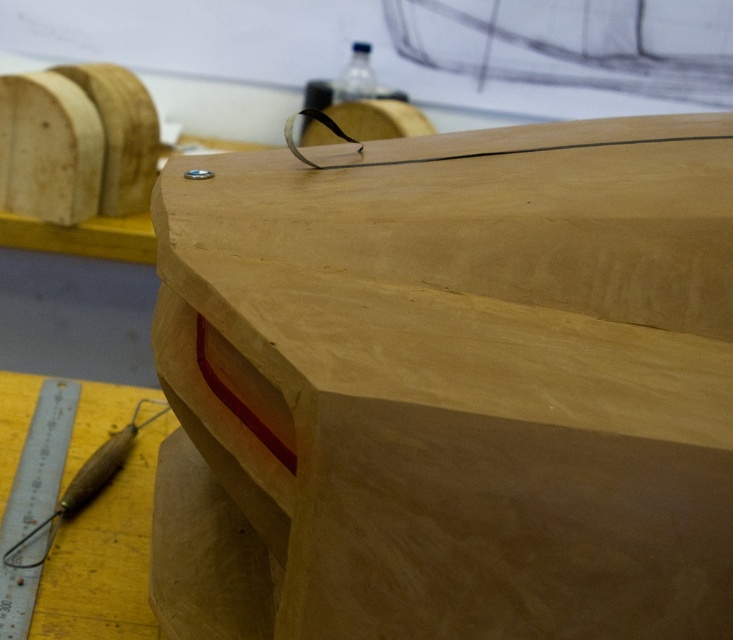
Measure the distance from natural wood plywood at center to wooden carving tool at lower left.

The distance of natural wood plywood at center from wooden carving tool at lower left is 27.07 inches.

Is point (485, 193) more distant than point (95, 467)?

No, (485, 193) is in front of (95, 467).

I want to click on natural wood plywood at center, so click(467, 374).

Image resolution: width=733 pixels, height=640 pixels. Find the location of `natural wood plywood at center`. natural wood plywood at center is located at coordinates click(467, 374).

This screenshot has height=640, width=733. What do you see at coordinates (467, 374) in the screenshot? I see `natural wood plywood at center` at bounding box center [467, 374].

Who is lower down, natural wood plywood at center or metallic silver ruler at lower left?

metallic silver ruler at lower left is lower down.

The width and height of the screenshot is (733, 640). Find the location of `natural wood plywood at center`. natural wood plywood at center is located at coordinates (467, 374).

Who is taller, natural wood plywood at center or transparent plastic bottle at upper center?

A: natural wood plywood at center is taller.

Is point (303, 291) positioned after point (350, 68)?

No, it is not.

I want to click on natural wood plywood at center, so click(x=467, y=374).

Find the location of a particular element. natural wood plywood at center is located at coordinates (467, 374).